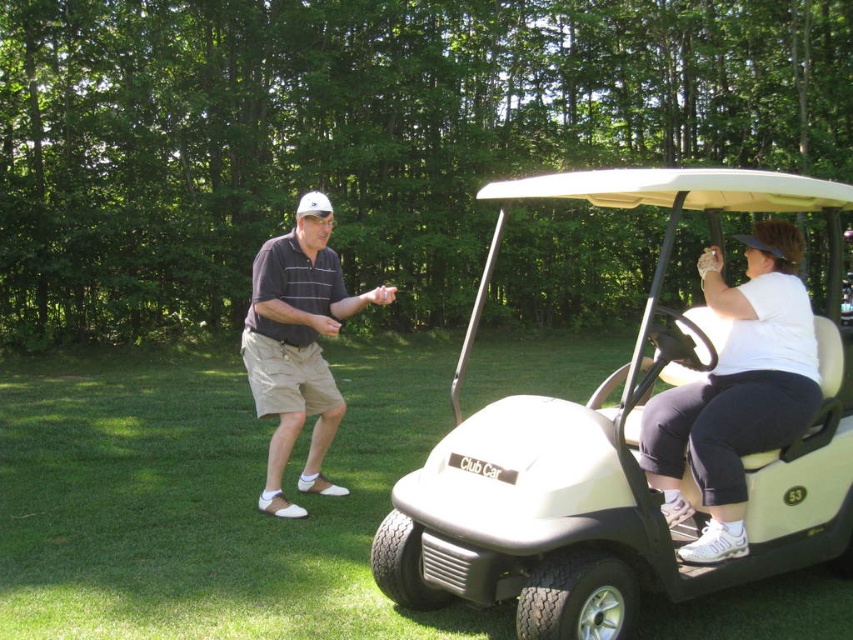
Between point (659, 305) and point (281, 236), which one is positioned behind?

Positioned behind is point (659, 305).

Is white matte golf cart at right wider than dark gray cotton polo shirt at center?

Indeed, white matte golf cart at right has a greater width compared to dark gray cotton polo shirt at center.

Is point (613, 538) in front of point (341, 280)?

Yes, it is.

The height and width of the screenshot is (640, 853). In order to click on white matte golf cart at right in this screenshot , I will do `click(614, 452)`.

Which is behind, point (254, 572) or point (636, 592)?

Positioned behind is point (254, 572).

What do you see at coordinates (204, 500) in the screenshot? I see `white plastic golf cart at center` at bounding box center [204, 500].

What do you see at coordinates (204, 500) in the screenshot? I see `white plastic golf cart at center` at bounding box center [204, 500].

Locate an element on the screen. The width and height of the screenshot is (853, 640). white plastic golf cart at center is located at coordinates (204, 500).

Can you confirm if white plastic golf cart at center is positioned to the left of dark gray cotton polo shirt at center?

No, white plastic golf cart at center is not to the left of dark gray cotton polo shirt at center.

Is white plastic golf cart at center positioned behind dark gray cotton polo shirt at center?

That is False.

Who is more distant from viewer, (730, 596) or (291, 326)?

Positioned behind is point (291, 326).

Where is `white plastic golf cart at center`? This screenshot has width=853, height=640. white plastic golf cart at center is located at coordinates (204, 500).